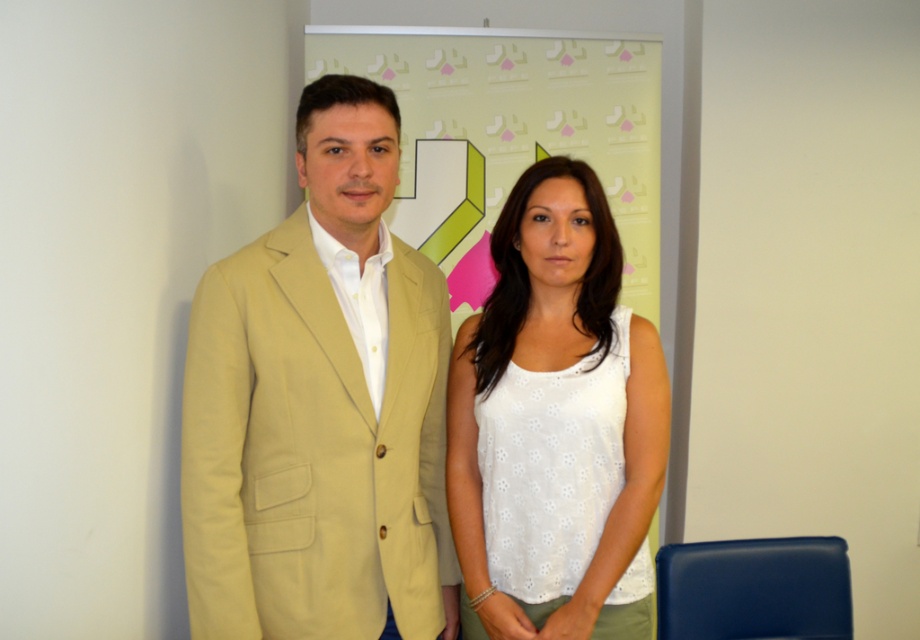
You are a photographer setting up for a group photo. You notice the beige fabric suit at center and the light green fabric banner at center. Which object is closer to the camera?

The beige fabric suit at center is closer to the camera because it is in front of the light green fabric banner at center.

Please describe the position of the beige fabric suit at center in the image using coordinates. The coordinate system is defined with the origin at the bottom left corner of the image, where the x and y axes increase to the right and upward respectively. The maximum x and y values are both 1.0. Please provide the coordinates as a tuple with two decimal places.

The beige fabric suit at center is located at coordinates approximately 0.634 in the x direction and 0.349 in the y direction.

You are organizing a photoshoot and need to ensure that the white dotted tank top at center is visible in the frame. Given that the light green fabric banner at center is already positioned, how can you adjust the camera angle to make sure both objects are in view?

Since the white dotted tank top at center is smaller than the light green fabric banner at center, you can zoom out slightly to include both objects in the frame while ensuring the tank top remains visible.